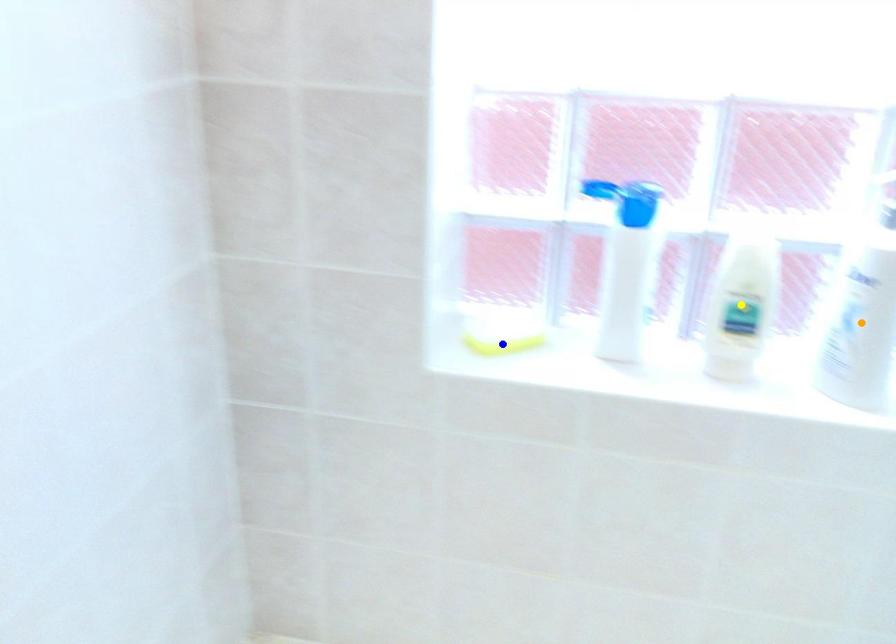
Order these from nearest to farthest:
1. blue point
2. yellow point
3. orange point

orange point
yellow point
blue point